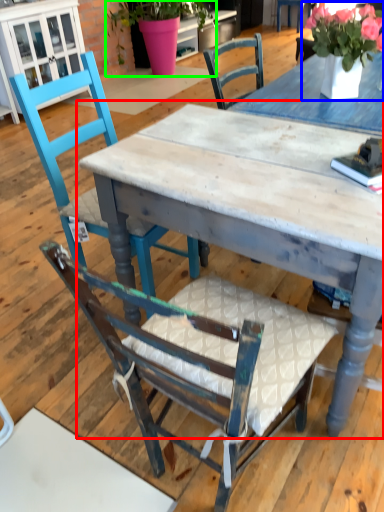
Question: Based on their relative distances, which object is farther from table (highlighted by a red box)? Choose from floral arrangement (highlighted by a blue box) and houseplant (highlighted by a green box).

Choices:
 (A) floral arrangement
 (B) houseplant

Answer: (B)